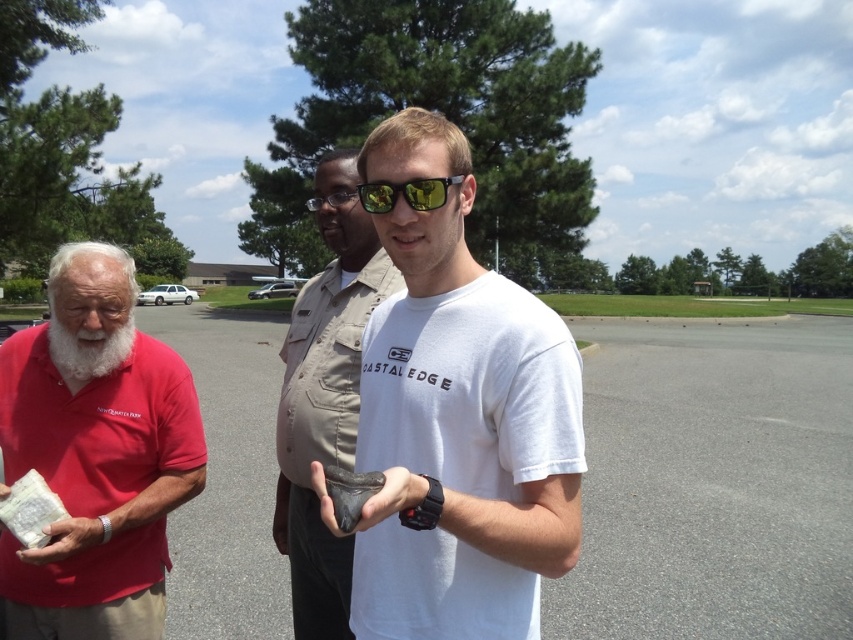
You are standing at the point labeled point (358, 196) and want to walk to the point labeled point (74, 368). Which direction should you face to move towards your destination?

To move from point (358, 196) to point (74, 368), you should face towards the direction where the x increases and y decreases, as point (74, 368) has a higher x coordinate and lower y coordinate compared to point (358, 196).

Based on the coordinates provided, which object corresponds to the point at (96, 456)?

The point at (96, 456) corresponds to the matte red shirt at left.

You are a photographer trying to capture a portrait of the person wearing the yellow reflective lens at center without including the matte red shirt at left in the frame. Based on their positions, is this possible?

The matte red shirt at left is below the yellow reflective lens at center, so if you position the camera to focus on the upper area where the yellow reflective lens at center is located, you can exclude the matte red shirt at left from the frame.